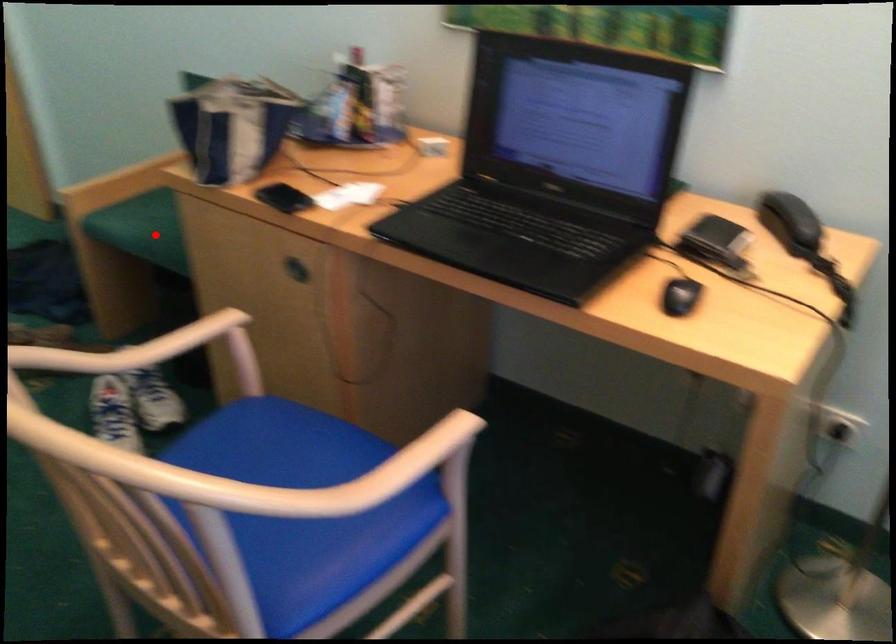
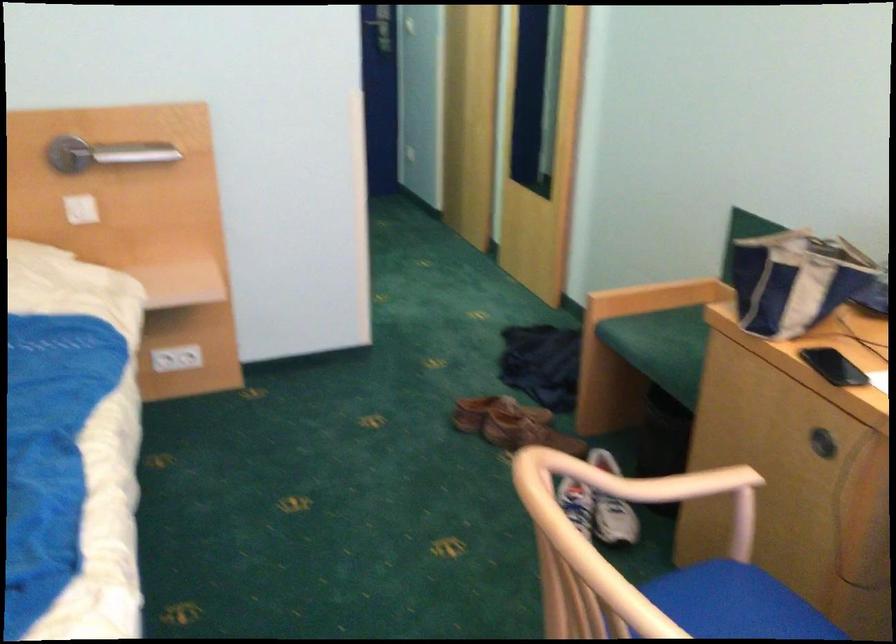
Where in the second image is the point corresponding to the highlighted location from the first image?

(661, 346)